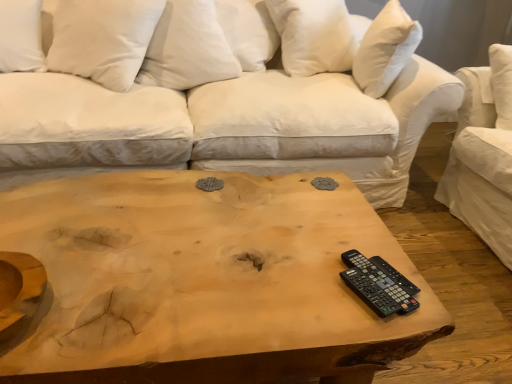
The image size is (512, 384). I want to click on vacant area that is in front of black plastic remote at lower right, so click(374, 319).